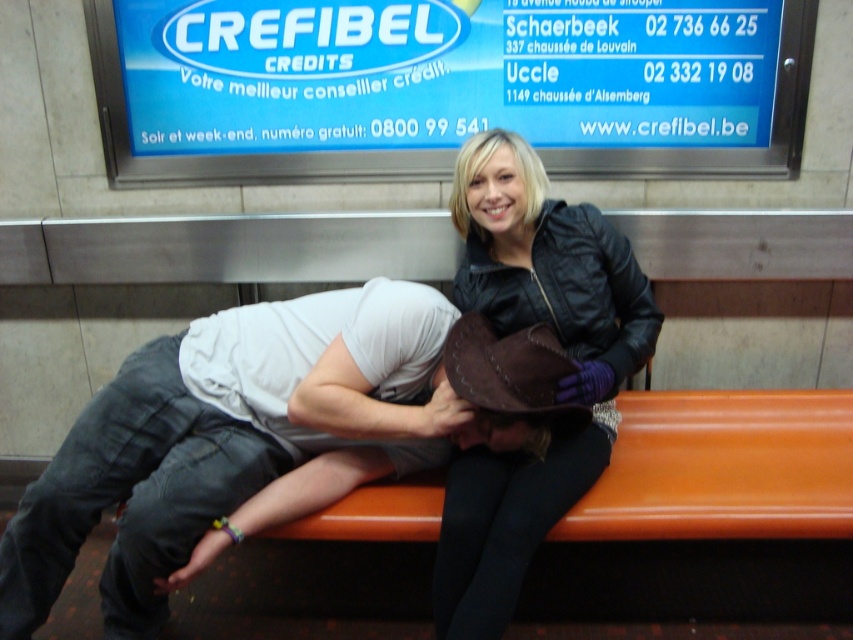
You are standing in front of the bench in the train station. You want to place a small bag between the gray cotton pants at left and the edge of the bench. Is there enough space?

The gray cotton pants at left is 1.55 meters away from viewer, so placing a small bag between them and the edge of the bench would require knowing the bench length. However, since the distance from viewer is given, we can infer the bench is at least 1.55 meters long. Assuming standard bench widths, there is likely enough space for the bag.

You are a photographer standing at the point with coordinates (224,436) in the image. What object are you directly facing?

The point at (224,436) is on the gray cotton pants at left, so you are directly facing the gray cotton pants at left.